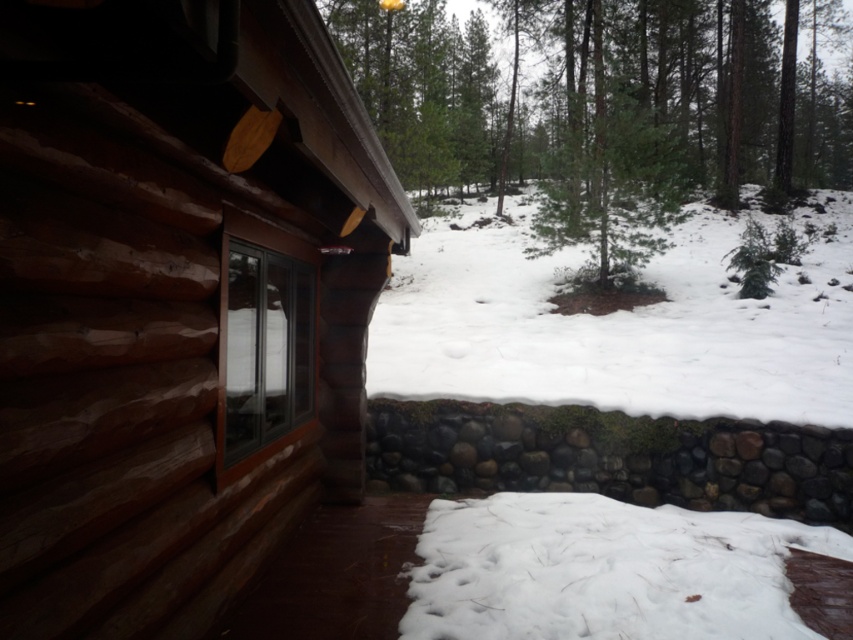
You are standing in front of the rustic log cabin and notice a point marked on the image. What object is located at the coordinates point [593,102]?

The point [593,102] indicates a green textured pine tree at center.

You are a delivery drone with a package that requires a safe landing spot between the brown wooden cabin at left and the clear glass window at center. The minimum safe distance required for landing is 12 inches. Can you land safely between them?

The distance between the brown wooden cabin at left and the clear glass window at center is 12.93 inches, which exceeds the minimum required 12 inches. Therefore, the drone can land safely between them.

You are standing in front of the rustic log cabin and notice the green textured pine tree at center and the white fluffy snow at lower center. Which object is closer to you as you face the cabin?

The green textured pine tree at center is closer to you because the white fluffy snow at lower center is behind it.